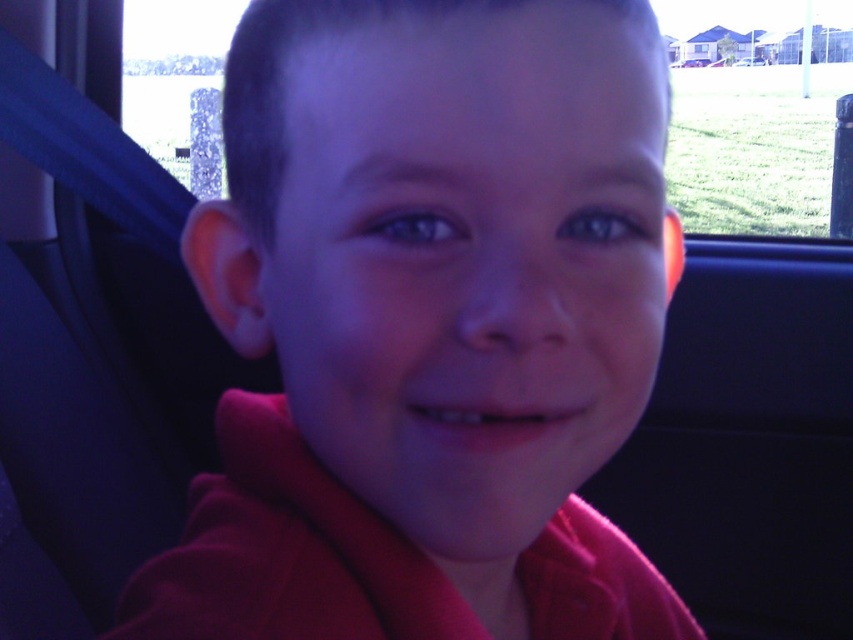
Question: Is matte red shirt at center positioned before transparent glass car window at upper center?

Choices:
 (A) yes
 (B) no

Answer: (A)

Question: Where is matte red shirt at center located in relation to transparent glass car window at upper center in the image?

Choices:
 (A) above
 (B) below

Answer: (B)

Question: Which point appears farthest from the camera in this image?

Choices:
 (A) (553, 467)
 (B) (241, 1)

Answer: (B)

Question: Among these points, which one is nearest to the camera?

Choices:
 (A) (318, 332)
 (B) (820, 160)

Answer: (A)

Question: Is matte red shirt at center smaller than transparent glass car window at upper center?

Choices:
 (A) yes
 (B) no

Answer: (A)